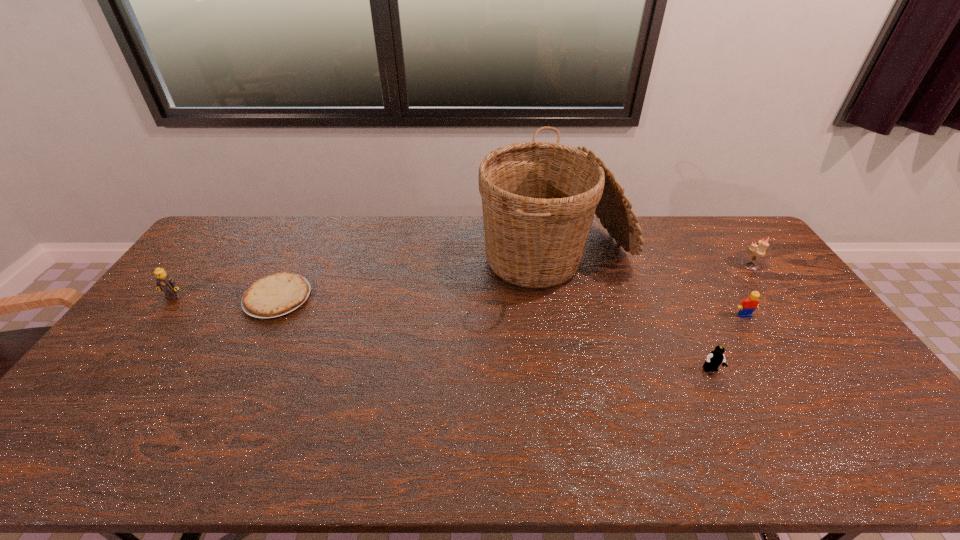
Identify the location of tortilla. The width and height of the screenshot is (960, 540). (275, 295).

This screenshot has height=540, width=960. I want to click on free spot located 0.330m on the right of the tallest object, so click(726, 261).

Locate an element on the screen. This screenshot has width=960, height=540. vacant space located 0.350m on the left of the candle holder is located at coordinates (640, 265).

Locate an element on the screen. free spot located 0.400m in front of the leftmost Lego is located at coordinates (88, 411).

Where is `free space located on the face of the fifth object from left to right`? The height and width of the screenshot is (540, 960). free space located on the face of the fifth object from left to right is located at coordinates (816, 429).

Identify the location of blank area located on the front-facing side of the nearest object. (747, 446).

Image resolution: width=960 pixels, height=540 pixels. Find the location of `free space located on the front of the shortest object`. free space located on the front of the shortest object is located at coordinates (256, 339).

Identify the location of object at the far edge. (538, 198).

This screenshot has height=540, width=960. Identify the location of object present at the left edge. (164, 282).

Locate an element on the screen. This screenshot has width=960, height=540. object located in the right edge section of the desktop is located at coordinates (759, 250).